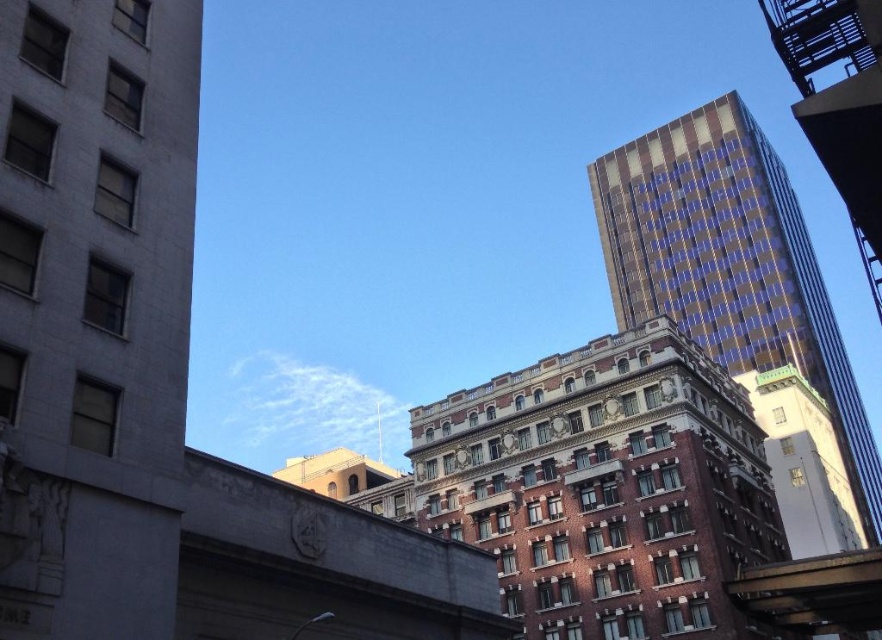
You are standing at the point marked by the coordinates point (94, 310) in the image. Looking around, you see a gray concrete building at left. Which direction should you walk to move away from the gray concrete building at left?

Since the point (94, 310) marks the gray concrete building at left, you should walk to the right to move away from it.

You are standing in the urban scene and want to take a photo. There are two points marked in the image, point (13,275) and point (861,518). Which point will appear larger in your photo?

Point (13,275) is closer to the camera than point (861,518), so it will appear larger in the photo.